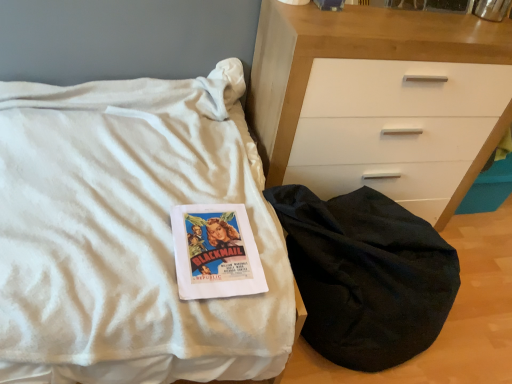
Locate an element on the screen. The image size is (512, 384). white soft blanket at center is located at coordinates (130, 234).

The image size is (512, 384). I want to click on white soft blanket at center, so click(x=130, y=234).

Is black fabric sleeping bag at lower right far from white soft blanket at center?

black fabric sleeping bag at lower right is actually quite close to white soft blanket at center.

From the image's perspective, which one is positioned higher, black fabric sleeping bag at lower right or white soft blanket at center?

From the image's view, white soft blanket at center is above.

Considering the positions of points (403, 215) and (76, 242), is point (403, 215) farther from camera compared to point (76, 242)?

Yes, point (403, 215) is farther from viewer.

Is white matte chest of drawers at center positioned with its back to black fabric sleeping bag at lower right?

No, white matte chest of drawers at center is not facing away from black fabric sleeping bag at lower right.

From the image's perspective, does white matte chest of drawers at center appear lower than black fabric sleeping bag at lower right?

Incorrect, from the image's perspective, white matte chest of drawers at center is higher than black fabric sleeping bag at lower right.

Considering the relative sizes of white matte chest of drawers at center and black fabric sleeping bag at lower right in the image provided, is white matte chest of drawers at center smaller than black fabric sleeping bag at lower right?

Actually, white matte chest of drawers at center might be larger than black fabric sleeping bag at lower right.

Does white matte chest of drawers at center have a lesser height compared to black fabric sleeping bag at lower right?

No, white matte chest of drawers at center is not shorter than black fabric sleeping bag at lower right.

Measure the distance from white matte chest of drawers at center to white soft blanket at center.

white matte chest of drawers at center and white soft blanket at center are 21.16 inches apart from each other.

From a real-world perspective, which is physically above, white matte chest of drawers at center or white soft blanket at center?

From a 3D spatial view, white matte chest of drawers at center is above.

Considering the sizes of objects white matte chest of drawers at center and white soft blanket at center in the image provided, who is thinner, white matte chest of drawers at center or white soft blanket at center?

white matte chest of drawers at center.

Where is `the chest of drawers that appears above the white soft blanket at center (from a real-world perspective)`? Image resolution: width=512 pixels, height=384 pixels. the chest of drawers that appears above the white soft blanket at center (from a real-world perspective) is located at coordinates (380, 101).

Consider the image. Considering the positions of objects white soft blanket at center and white matte chest of drawers at center in the image provided, who is behind, white soft blanket at center or white matte chest of drawers at center?

white matte chest of drawers at center is further away from the camera.

Can you confirm if black fabric sleeping bag at lower right is wider than white matte chest of drawers at center?

Correct, the width of black fabric sleeping bag at lower right exceeds that of white matte chest of drawers at center.

Can you tell me how much black fabric sleeping bag at lower right and white matte chest of drawers at center differ in facing direction?

black fabric sleeping bag at lower right and white matte chest of drawers at center are facing 1.84e-05 degrees away from each other.

Which is more to the left, black fabric sleeping bag at lower right or white matte chest of drawers at center?

Positioned to the left is black fabric sleeping bag at lower right.

From the image's perspective, is black fabric sleeping bag at lower right positioned above or below white matte chest of drawers at center?

From the image's perspective, black fabric sleeping bag at lower right appears below white matte chest of drawers at center.

From a real-world perspective, is white soft blanket at center over black fabric sleeping bag at lower right?

Yes, from a real-world perspective, white soft blanket at center is above black fabric sleeping bag at lower right.

Does white soft blanket at center have a greater width compared to black fabric sleeping bag at lower right?

Indeed, white soft blanket at center has a greater width compared to black fabric sleeping bag at lower right.

From the image's perspective, which is below, white soft blanket at center or black fabric sleeping bag at lower right?

black fabric sleeping bag at lower right appears lower in the image.

Is white soft blanket at center taller than black fabric sleeping bag at lower right?

Indeed, white soft blanket at center has a greater height compared to black fabric sleeping bag at lower right.

Image resolution: width=512 pixels, height=384 pixels. Identify the location of bed above the black fabric sleeping bag at lower right (from a real-world perspective). (130, 234).

Identify the location of chest of drawers above the black fabric sleeping bag at lower right (from the image's perspective). The height and width of the screenshot is (384, 512). (380, 101).

Estimate the real-world distances between objects in this image. Which object is closer to white soft blanket at center, white matte chest of drawers at center or black fabric sleeping bag at lower right?

The object closer to white soft blanket at center is black fabric sleeping bag at lower right.

Considering their positions, is white soft blanket at center positioned closer to black fabric sleeping bag at lower right than white matte chest of drawers at center?

white matte chest of drawers at center is positioned closer to the anchor black fabric sleeping bag at lower right.

Based on their spatial positions, is black fabric sleeping bag at lower right or white soft blanket at center further from white matte chest of drawers at center?

Among the two, white soft blanket at center is located further to white matte chest of drawers at center.

Which object lies further to the anchor point white matte chest of drawers at center, white soft blanket at center or black fabric sleeping bag at lower right?

Answer: The object further to white matte chest of drawers at center is white soft blanket at center.

Which object lies nearer to the anchor point black fabric sleeping bag at lower right, white matte chest of drawers at center or white soft blanket at center?

Among the two, white matte chest of drawers at center is located nearer to black fabric sleeping bag at lower right.

Considering their positions, is black fabric sleeping bag at lower right positioned closer to white soft blanket at center than white matte chest of drawers at center?

Based on the image, black fabric sleeping bag at lower right appears to be nearer to white soft blanket at center.

Locate an element on the screen. The width and height of the screenshot is (512, 384). sleeping bag between white soft blanket at center and white matte chest of drawers at center from left to right is located at coordinates (366, 275).